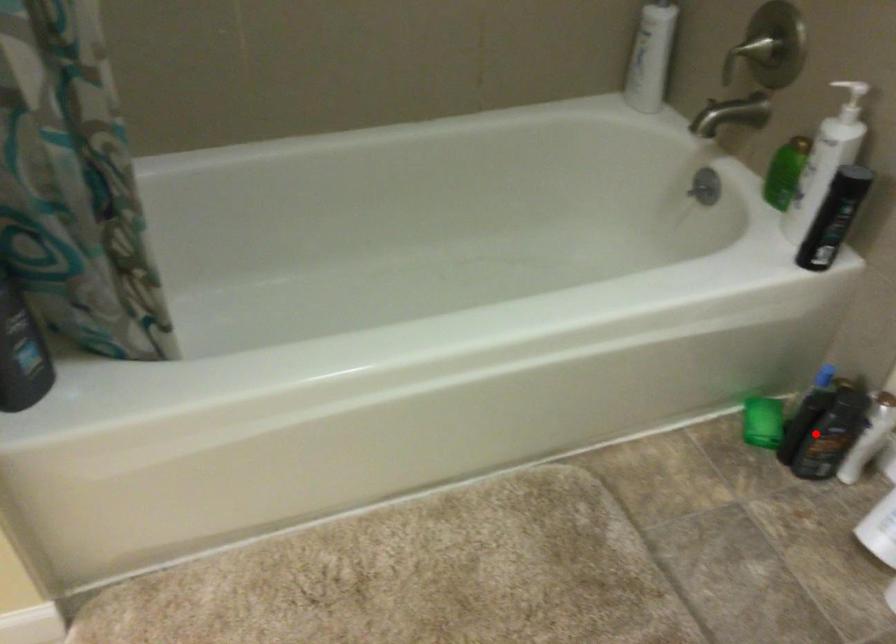
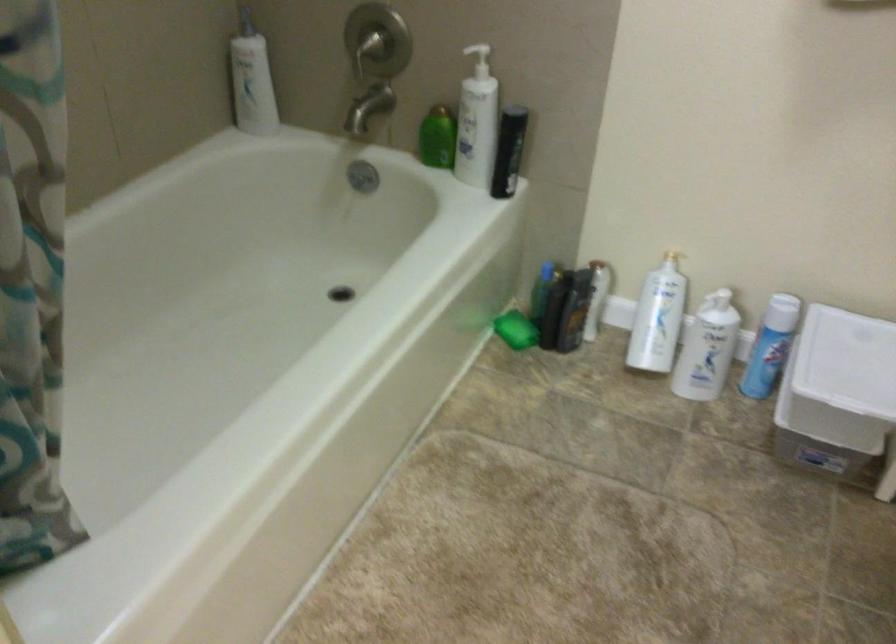
Question: I am providing you with two images of the same scene from different viewpoints. Given a red point in image1, look at the same physical point in image2. Is it:

Choices:
 (A) Closer to the viewpoint
 (B) Farther from the viewpoint

Answer: (B)